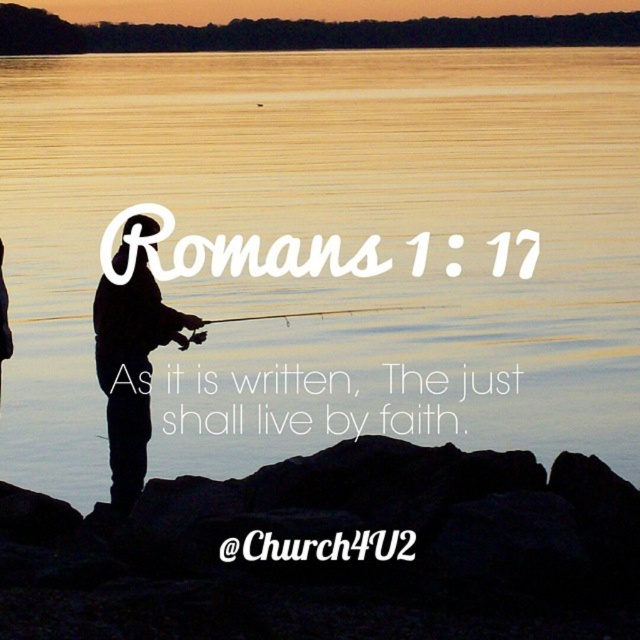
Question: From the image, what is the correct spatial relationship of matte black fishing pole at center in relation to matte black fishing rod at left?

Choices:
 (A) right
 (B) left

Answer: (A)

Question: Is black matte fisherman at center positioned before matte black fishing rod at left?

Choices:
 (A) no
 (B) yes

Answer: (B)

Question: Is black matte fisherman at center to the right of matte black fishing pole at center from the viewer's perspective?

Choices:
 (A) yes
 (B) no

Answer: (B)

Question: Among these points, which one is nearest to the camera?

Choices:
 (A) (456, 316)
 (B) (289, 314)

Answer: (B)

Question: Which object appears farthest from the camera in this image?

Choices:
 (A) matte black fishing pole at center
 (B) matte black fishing rod at left
 (C) silvery water at center

Answer: (B)

Question: Which object is farther from the camera taking this photo?

Choices:
 (A) silvery water at center
 (B) black matte fisherman at center
 (C) matte black fishing rod at left
 (D) matte black fishing pole at center

Answer: (C)